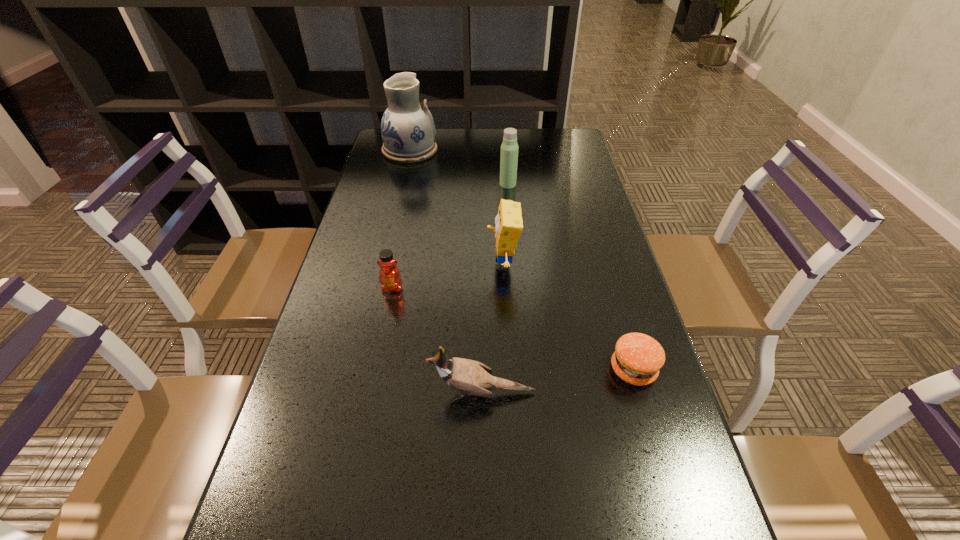
The height and width of the screenshot is (540, 960). What are the coordinates of `pottery` in the screenshot? It's located at (408, 130).

You are a GUI agent. You are given a task and a screenshot of the screen. Output one action in this format:
    pyautogui.click(x=<x>, y=<y>)
    Task: Click on the farthest object
    
    Given the screenshot: What is the action you would take?
    pyautogui.click(x=408, y=130)

This screenshot has width=960, height=540. Find the location of `thermos bottle`. thermos bottle is located at coordinates (509, 149).

Image resolution: width=960 pixels, height=540 pixels. What are the coordinates of `sponge` in the screenshot? It's located at (509, 224).

Image resolution: width=960 pixels, height=540 pixels. I want to click on bird, so click(x=470, y=377).

Find the location of `honey`. honey is located at coordinates pyautogui.click(x=389, y=276).

Where is `the second shortest object`? The width and height of the screenshot is (960, 540). the second shortest object is located at coordinates (638, 358).

Where is `the rightmost object`? Image resolution: width=960 pixels, height=540 pixels. the rightmost object is located at coordinates (638, 358).

Find the location of a particular element. This screenshot has width=960, height=540. vacant area located on the front of the farthest object is located at coordinates (394, 218).

Where is `vacant point located on the left of the thermos bottle`? vacant point located on the left of the thermos bottle is located at coordinates (404, 184).